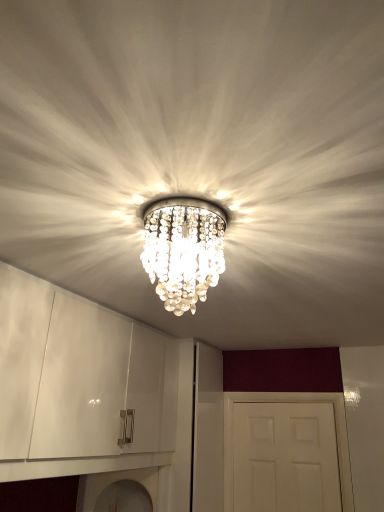
Question: Is white matte door at center surrounded by clear crystal chandelier at center?

Choices:
 (A) yes
 (B) no

Answer: (B)

Question: Is clear crystal chandelier at center taller than white matte door at center?

Choices:
 (A) no
 (B) yes

Answer: (A)

Question: Does clear crystal chandelier at center turn towards white matte door at center?

Choices:
 (A) yes
 (B) no

Answer: (B)

Question: Is clear crystal chandelier at center to the left of white matte door at center from the viewer's perspective?

Choices:
 (A) yes
 (B) no

Answer: (A)

Question: Is clear crystal chandelier at center at the right side of white matte door at center?

Choices:
 (A) yes
 (B) no

Answer: (B)

Question: From the image's perspective, would you say clear crystal chandelier at center is shown under white matte door at center?

Choices:
 (A) no
 (B) yes

Answer: (A)

Question: Is there a large distance between white matte door at center and clear crystal chandelier at center?

Choices:
 (A) yes
 (B) no

Answer: (A)

Question: Is white matte door at center positioned with its back to clear crystal chandelier at center?

Choices:
 (A) no
 (B) yes

Answer: (A)

Question: Does white matte door at center have a lesser width compared to clear crystal chandelier at center?

Choices:
 (A) yes
 (B) no

Answer: (A)

Question: Does white matte door at center lie behind clear crystal chandelier at center?

Choices:
 (A) no
 (B) yes

Answer: (B)

Question: From the image's perspective, is white matte door at center beneath clear crystal chandelier at center?

Choices:
 (A) yes
 (B) no

Answer: (A)

Question: Does white matte door at center have a greater height compared to clear crystal chandelier at center?

Choices:
 (A) yes
 (B) no

Answer: (A)

Question: From a real-world perspective, is white matte door at center above or below clear crystal chandelier at center?

Choices:
 (A) above
 (B) below

Answer: (B)